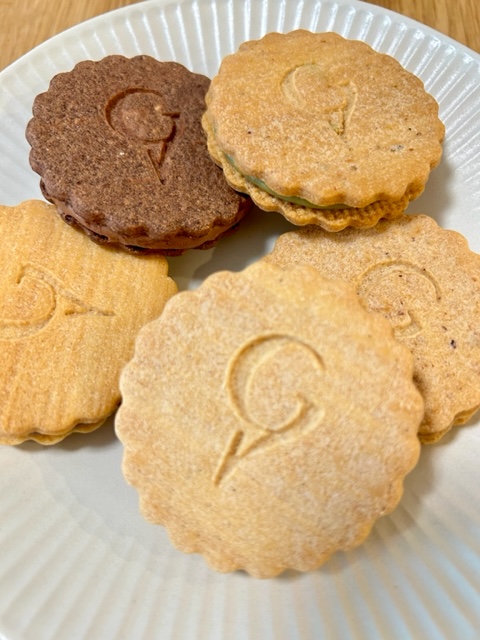
The image size is (480, 640). I want to click on white plate, so click(65, 528).